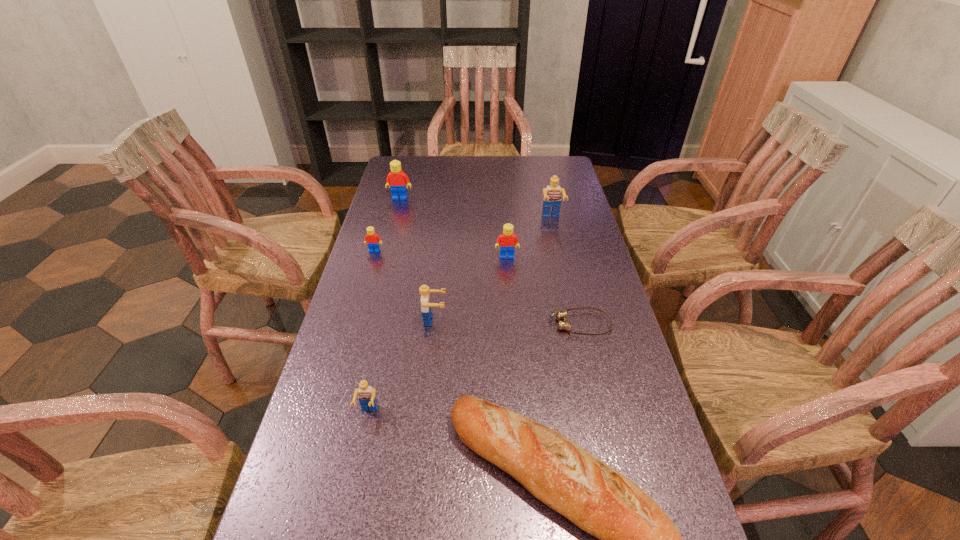
Select which Lego appears as the fourth closest to the baguet. Please provide its 2D coordinates. Your answer should be formatted as a tuple, i.e. [(x, y)], where the tuple contains the x and y coordinates of a point satisfying the conditions above.

[(372, 239)]

At what (x,y) coordinates should I click in order to perform the action: click on the third closest red Lego to the fourth Lego from left to right. Please return your answer as a coordinate pair (x, y). The image size is (960, 540). Looking at the image, I should click on (396, 180).

Locate which red Lego is the closest to the goggles. Please provide its 2D coordinates. Your answer should be formatted as a tuple, i.e. [(x, y)], where the tuple contains the x and y coordinates of a point satisfying the conditions above.

[(507, 240)]

Locate an element on the screen. The image size is (960, 540). the closest blue Lego to the lightbrown baguet is located at coordinates (367, 398).

Locate an element on the screen. This screenshot has height=540, width=960. blue Lego that is the second nearest to the biggest blue Lego is located at coordinates (367, 398).

At what (x,y) coordinates should I click in order to perform the action: click on vacant area that satisfies the following two spatial constraints: 1. on the face of the seventh nearest object; 2. on the face of the second blue Lego from left to right. Please return your answer as a coordinate pair (x, y). The width and height of the screenshot is (960, 540). Looking at the image, I should click on (573, 320).

Identify the location of vacant space that satisfies the following two spatial constraints: 1. on the face of the second smallest red Lego; 2. on the face of the second blue Lego from left to right. The width and height of the screenshot is (960, 540). coord(512,320).